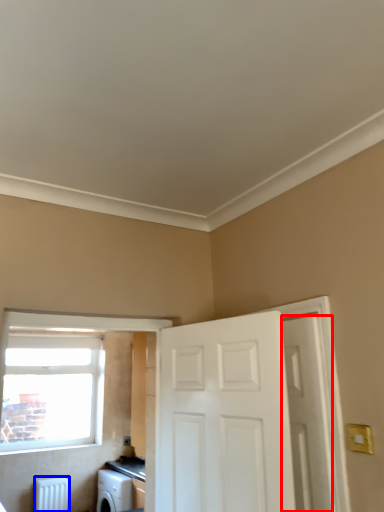
Question: Among these objects, which one is farthest to the camera, door (highlighted by a red box) or radiator (highlighted by a blue box)?

Choices:
 (A) door
 (B) radiator

Answer: (B)